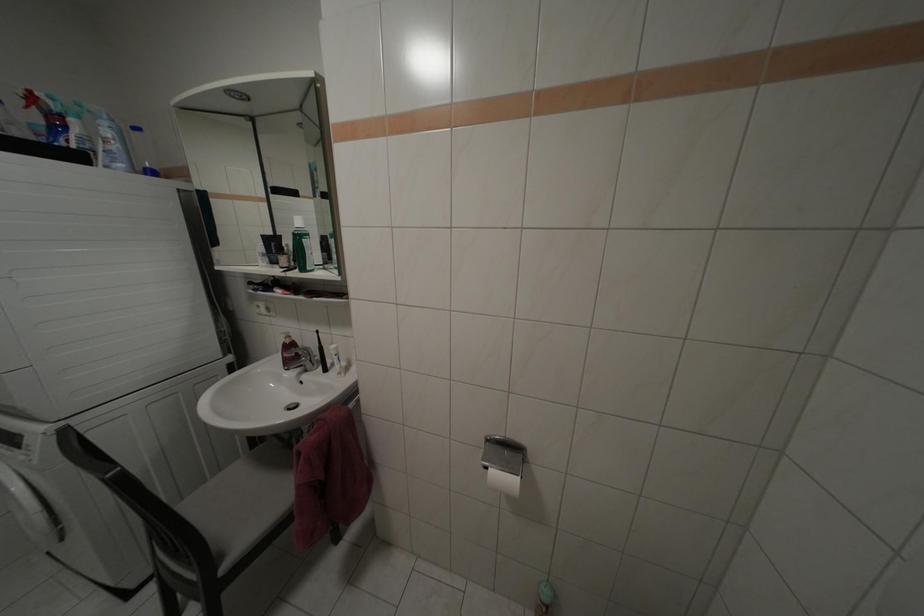
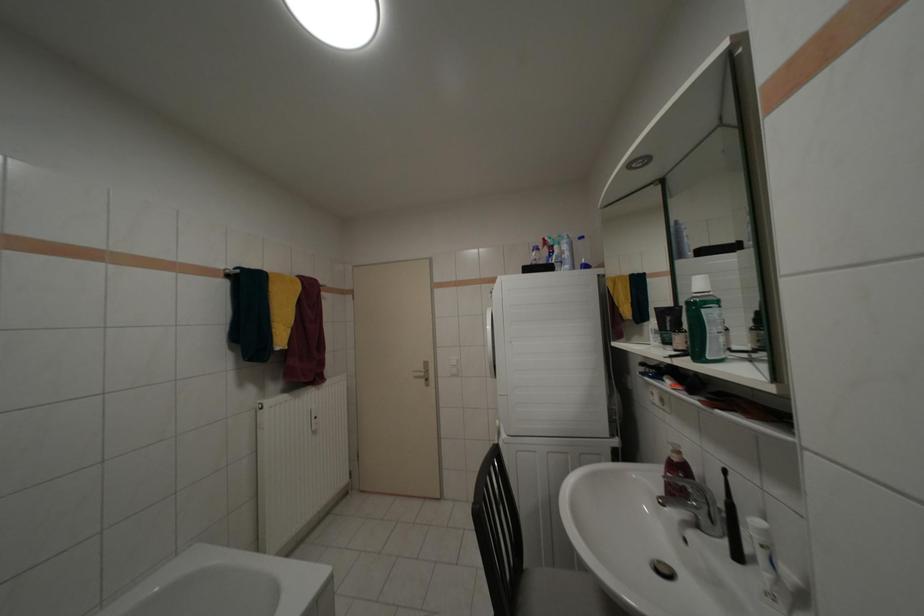
Question: The camera is either moving clockwise (left) or counter-clockwise (right) around the object. The first image is from the beginning of the video and the second image is from the end. Is the camera moving left or right when shooting the video?

Choices:
 (A) Left
 (B) Right

Answer: (B)